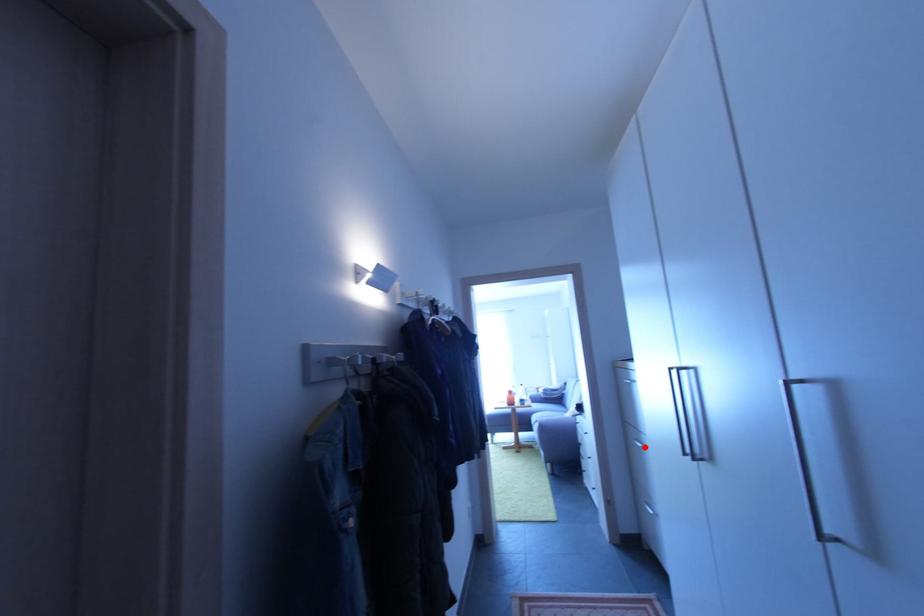
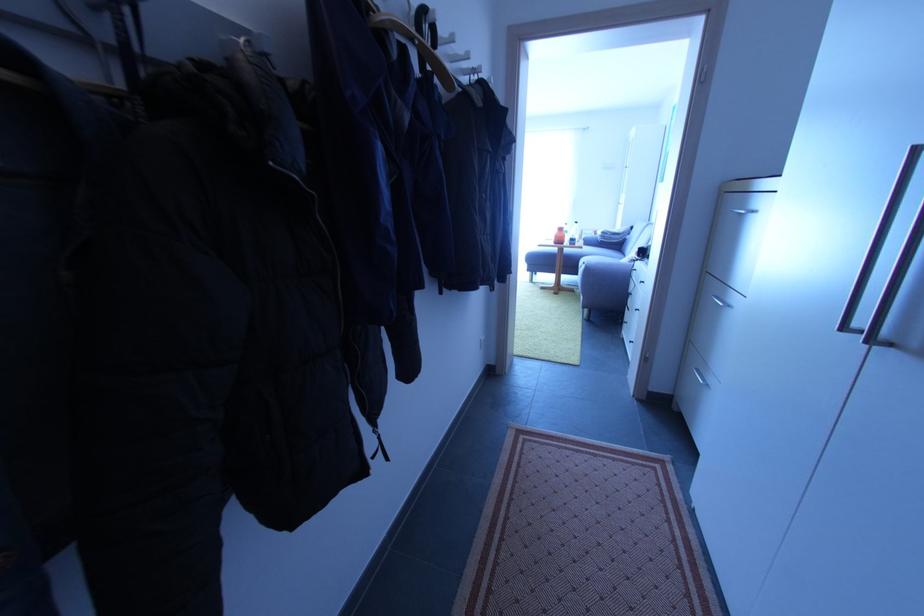
Question: I am providing you with two images of the same scene from different viewpoints. Given a red point in image1, look at the same physical point in image2. Is it:

Choices:
 (A) Closer to the viewpoint
 (B) Farther from the viewpoint

Answer: (A)